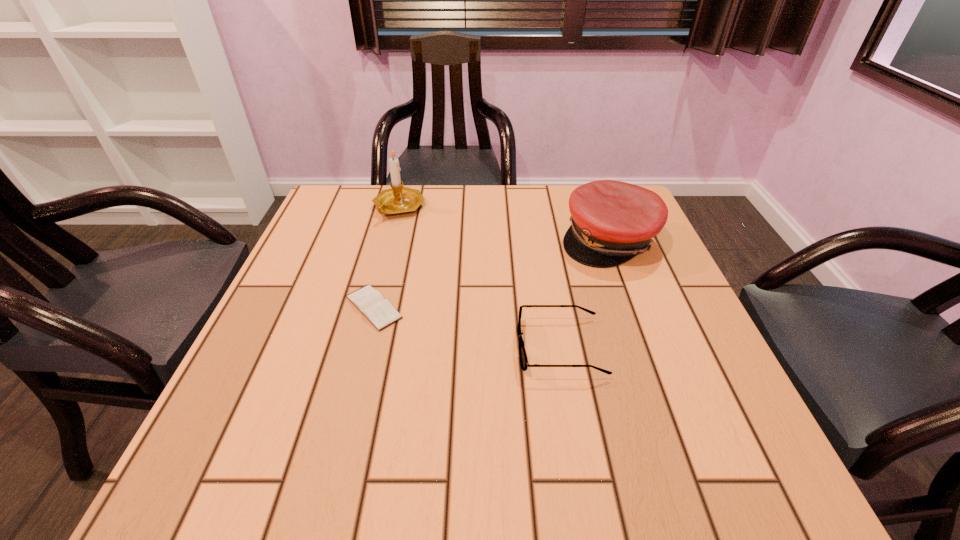
This screenshot has height=540, width=960. I want to click on vacant space that's between the tallest object and the spectacles, so click(479, 277).

Locate an element on the screen. The image size is (960, 540). vacant area between the candle holder and the spectacles is located at coordinates (479, 277).

Find the location of a particular element. free space between the tallest object and the shortest object is located at coordinates (386, 258).

Image resolution: width=960 pixels, height=540 pixels. Find the location of `object that can be found as the closest to the diary`. object that can be found as the closest to the diary is located at coordinates (522, 352).

Locate an element on the screen. the closest object to the third tallest object is located at coordinates (611, 221).

The image size is (960, 540). In order to click on blank area in the image that satisfies the following two spatial constraints: 1. on the front-facing side of the second tallest object; 2. on the front-facing side of the second shortest object in this screenshot , I will do `click(649, 347)`.

The width and height of the screenshot is (960, 540). I want to click on vacant space that satisfies the following two spatial constraints: 1. on the front-facing side of the second tallest object; 2. on the front-facing side of the third tallest object, so [649, 347].

Where is `free space in the image that satisfies the following two spatial constraints: 1. on the front-facing side of the second tallest object; 2. on the front-facing side of the spectacles`? The width and height of the screenshot is (960, 540). free space in the image that satisfies the following two spatial constraints: 1. on the front-facing side of the second tallest object; 2. on the front-facing side of the spectacles is located at coordinates (649, 347).